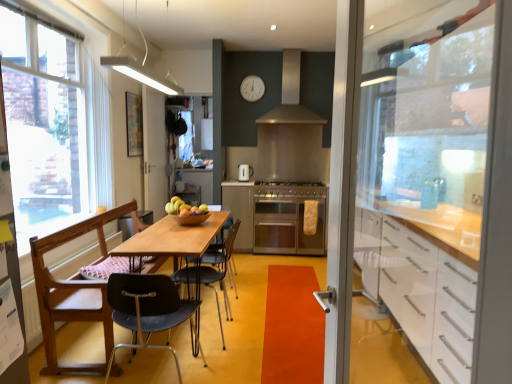
Identify the location of free spot in front of black plastic chair at center, the third chair in the front-to-back sequence. (217, 354).